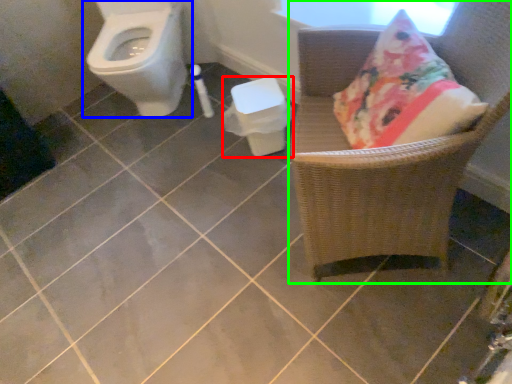
Question: Based on their relative distances, which object is farther from potty (highlighted by a red box)? Choose from toilet (highlighted by a blue box) and chair (highlighted by a green box).

Choices:
 (A) toilet
 (B) chair

Answer: (A)